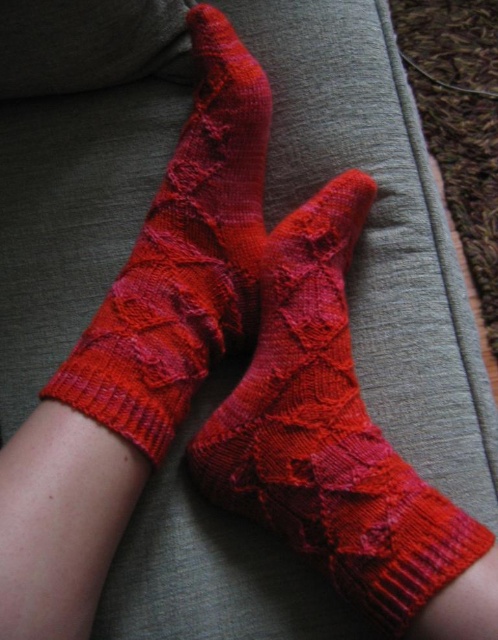
Question: Which point is closer to the camera taking this photo?

Choices:
 (A) (240, 420)
 (B) (252, 227)

Answer: (A)

Question: Does matte red yarn socks at center appear over matte red knitted socks at center?

Choices:
 (A) no
 (B) yes

Answer: (A)

Question: Is matte red yarn socks at center positioned at the back of matte red knitted socks at center?

Choices:
 (A) no
 (B) yes

Answer: (A)

Question: Where is matte red yarn socks at center located in relation to matte red knitted socks at center in the image?

Choices:
 (A) below
 (B) above

Answer: (A)

Question: Which object appears closest to the camera in this image?

Choices:
 (A) matte red knitted socks at center
 (B) matte red yarn socks at center

Answer: (B)

Question: Among these objects, which one is nearest to the camera?

Choices:
 (A) matte red knitted socks at center
 (B) matte red yarn socks at center

Answer: (B)